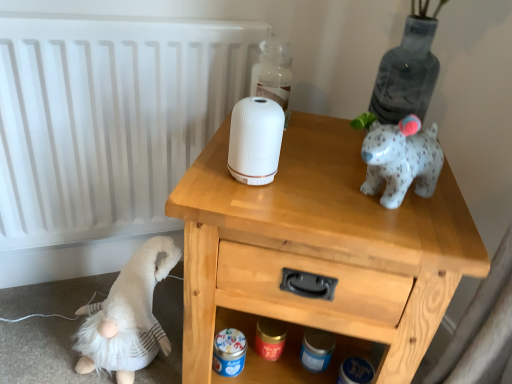
This screenshot has height=384, width=512. In order to click on blank space to the left of white matte speaker at center in this screenshot , I will do `click(202, 173)`.